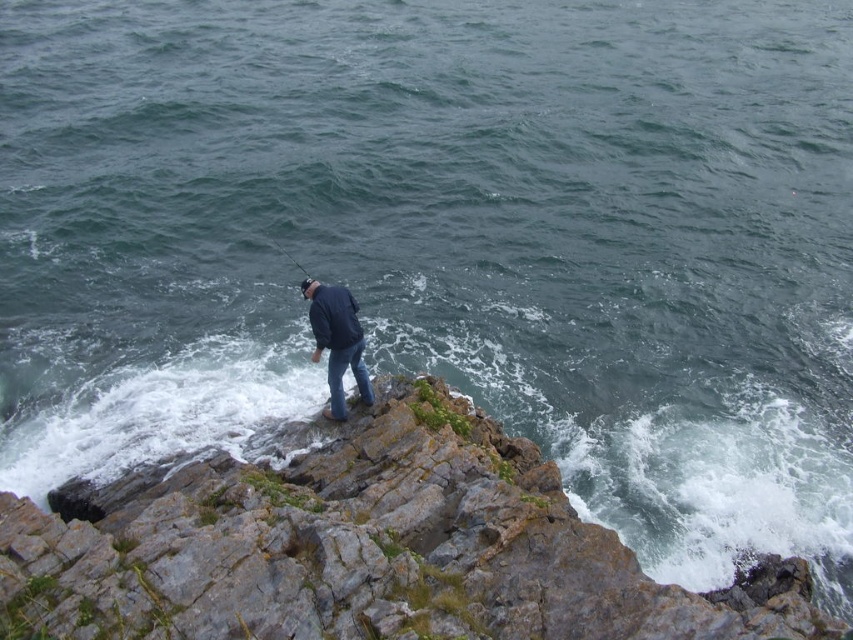
Between gray rocky cliff at center and dark blue jacket at center, which one is positioned lower?

gray rocky cliff at center is below.

Can you confirm if gray rocky cliff at center is positioned to the right of dark blue jacket at center?

Yes, gray rocky cliff at center is to the right of dark blue jacket at center.

Is point (361, 461) less distant than point (357, 344)?

That is True.

This screenshot has height=640, width=853. I want to click on gray rocky cliff at center, so click(364, 548).

Can you confirm if dark blue jacket at center is bigger than smooth black rod at center?

Yes, dark blue jacket at center is bigger than smooth black rod at center.

Locate an element on the screen. dark blue jacket at center is located at coordinates (337, 340).

Where is `dark blue jacket at center`? The image size is (853, 640). dark blue jacket at center is located at coordinates coord(337,340).

Which is behind, point (409, 534) or point (277, 248)?

The point (277, 248) is behind.

Who is lower down, gray rocky cliff at center or smooth black rod at center?

Positioned lower is gray rocky cliff at center.

Who is more distant from viewer, (395, 620) or (271, 241)?

Point (271, 241)

This screenshot has height=640, width=853. I want to click on gray rocky cliff at center, so click(x=364, y=548).